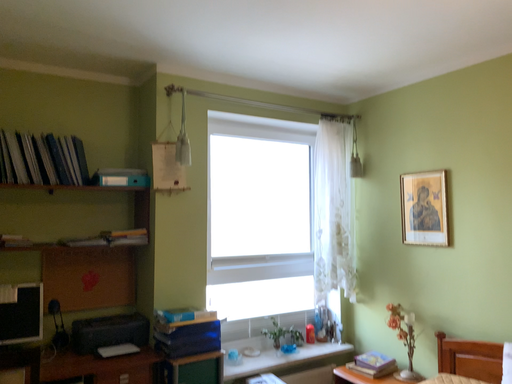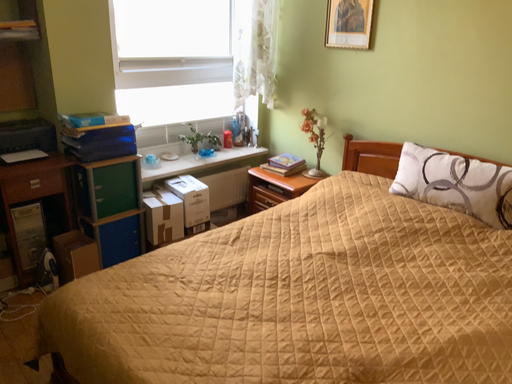
Question: Which way did the camera rotate in the video?

Choices:
 (A) rotated left
 (B) rotated right

Answer: (B)